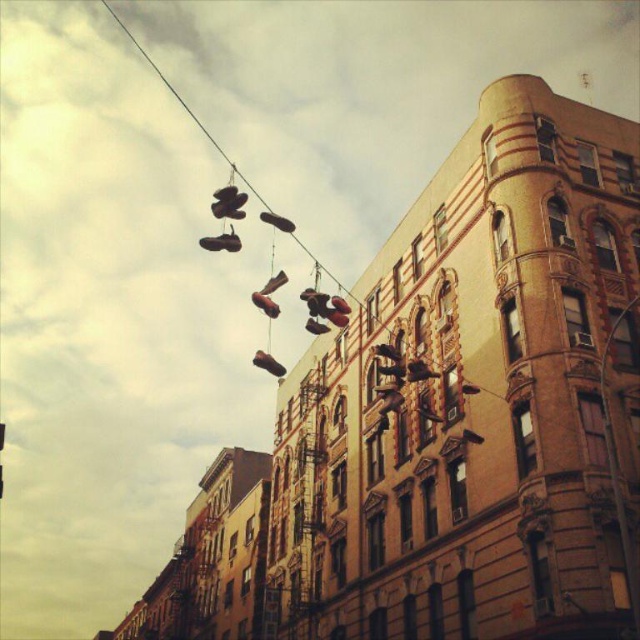
You are an artist planning to paint the urban scene with the artistic installation. You need to locate the shiny brown shoe at center precisely. According to the coordinates provided, where should you place it on your canvas?

The shiny brown shoe at center should be placed at coordinates point (268, 364) on the canvas.

Looking at this image, you are an art curator examining the installation of shoes suspended from a wire. You notice two shoes labeled as shiny brown shoe at center and matte brown shoe at center. Which of these two shoes is positioned lower in the installation?

The shiny brown shoe at center is positioned lower than the matte brown shoe at center in the installation.